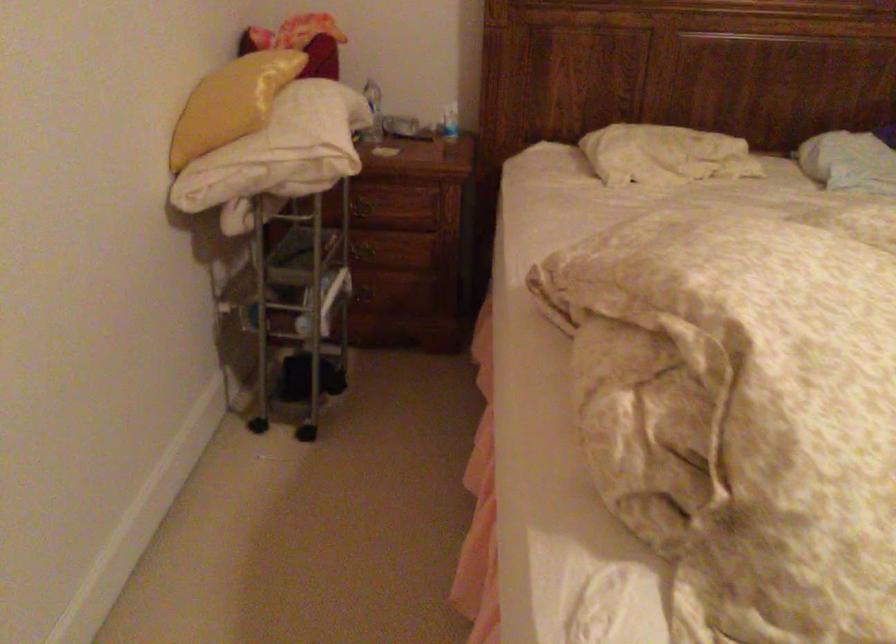
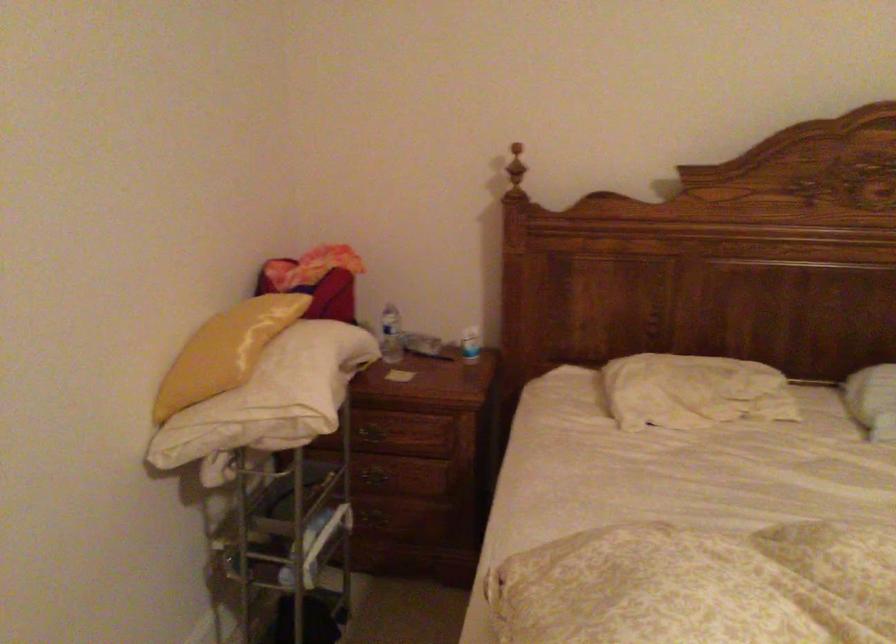
The point at (244, 96) is marked in the first image. Where is the corresponding point in the second image?

(225, 351)